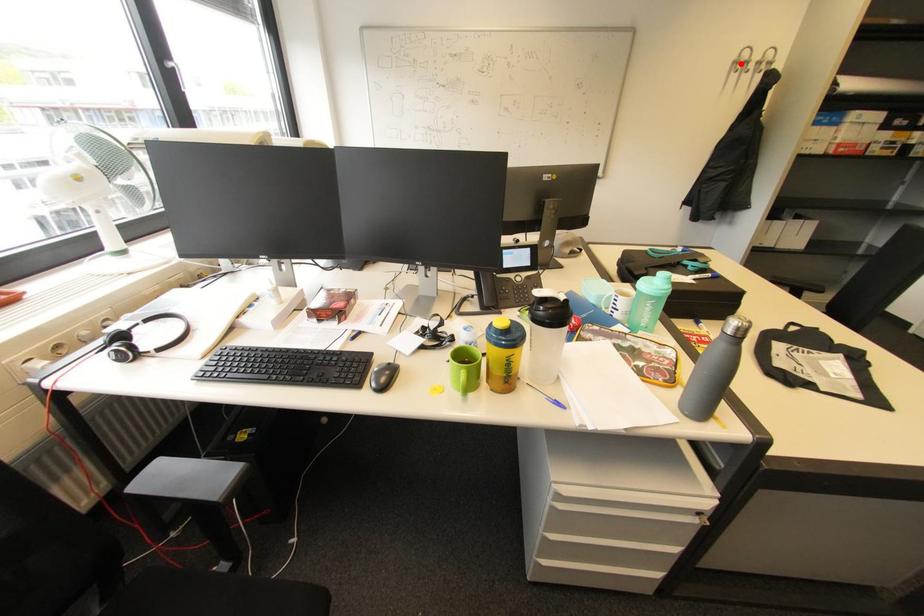
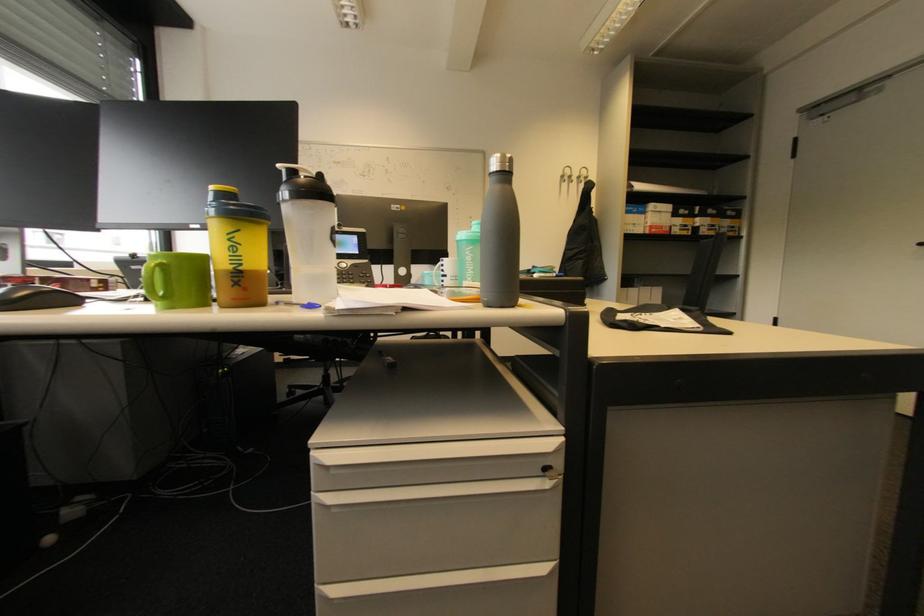
The point at the highlighted location is marked in the first image. Where is the corresponding point in the second image?

(567, 177)